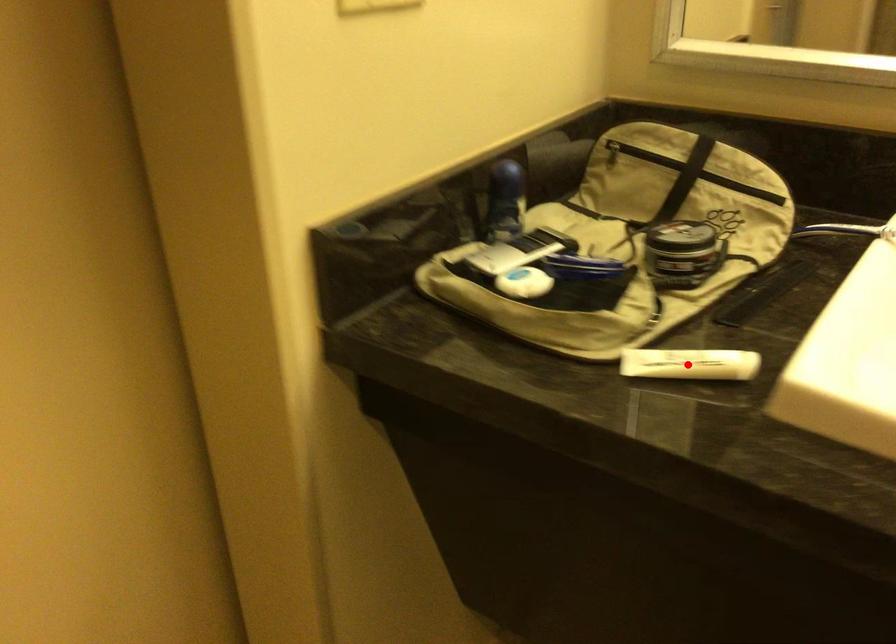
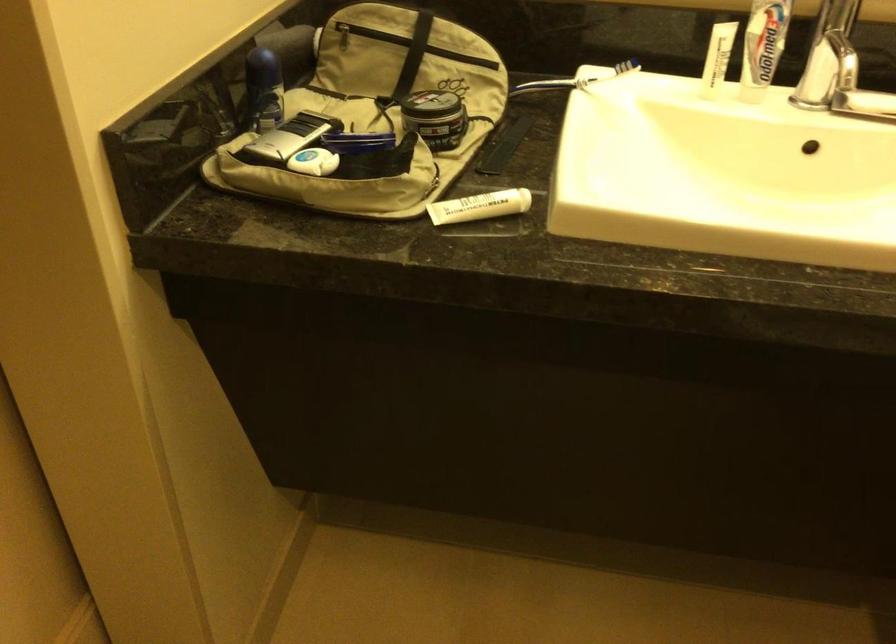
Question: A red point is marked in image1. In image2, is the corresponding 3D point closer to the camera or farther? Reply with the corresponding letter.

Choices:
 (A) The corresponding 3D point is closer.
 (B) The corresponding 3D point is farther.

Answer: (B)